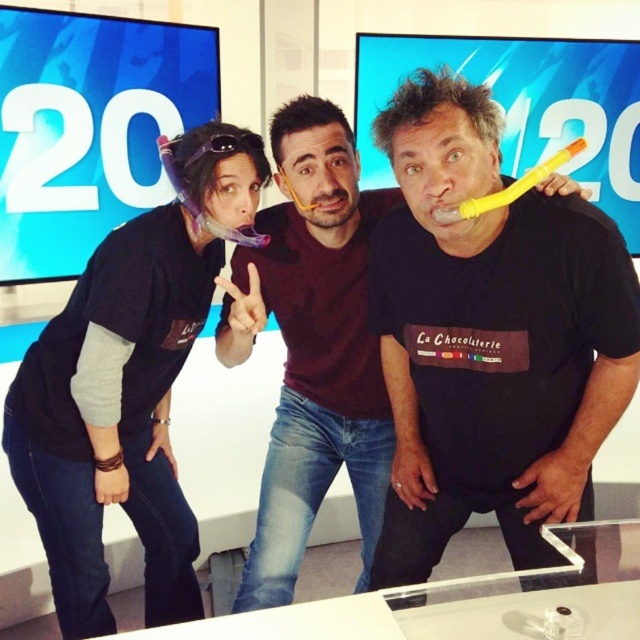
Looking at this image, you are standing in the studio and want to determine which of the two points, point [358,360] or point [582,145], is closer to you. Based on the scene, which point is nearer?

Point [358,360] is closer to you because it is further to the viewer than point [582,145].